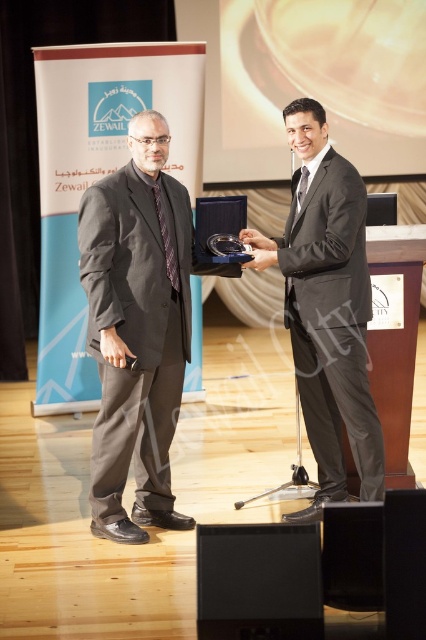
Question: Is matte black suit at left smaller than shiny black suit at center?

Choices:
 (A) no
 (B) yes

Answer: (A)

Question: Which of the following is the farthest from the observer?

Choices:
 (A) (256, 236)
 (B) (115, 472)

Answer: (A)

Question: Is matte black suit at left wider than shiny black suit at center?

Choices:
 (A) no
 (B) yes

Answer: (B)

Question: Is matte black suit at left below shiny black suit at center?

Choices:
 (A) no
 (B) yes

Answer: (B)